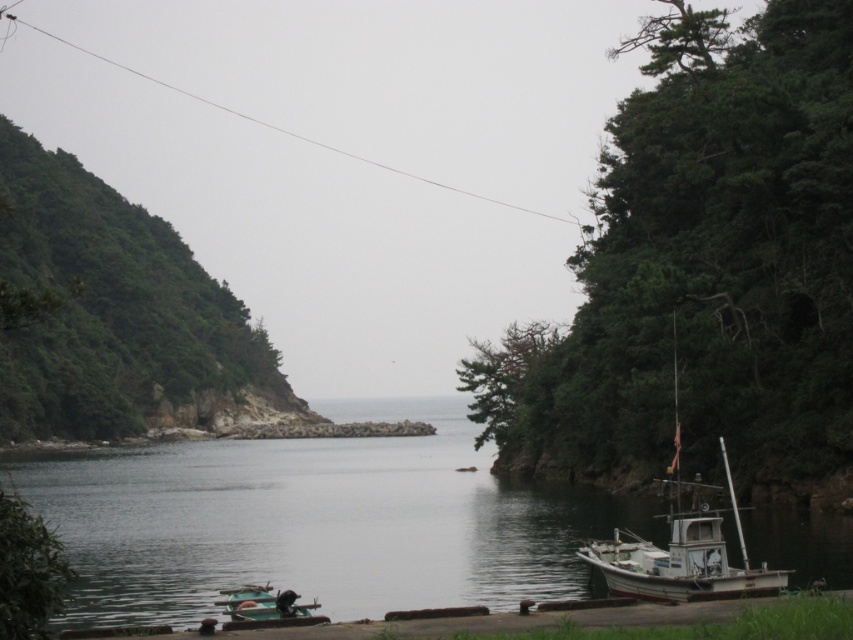
You are standing at the center of the image and want to walk towards the two points marked in the scene. Which point, point (74,211) or point (293,611), will you reach first?

Point (74,211) is further to the viewer than point (293,611), so you will reach point (74,211) first.

You are a photographer planning to capture the white matte boat at right and the green matte boat at lower left in a single frame. Based on their positions, which boat should you focus on first to ensure both are in the frame without moving the camera?

The white matte boat at right is positioned on the right side of the green matte boat at lower left, so you should focus on the green matte boat at lower left first to ensure both are within the frame without moving the camera.

You are a photographer planning to capture a landscape photo that emphasizes the green leafy hillside at left and the green matte boat at lower left. Based on their sizes in the image, which object should you focus on to ensure it dominates the composition?

The green leafy hillside at left is larger in size than the green matte boat at lower left, so focusing on it will ensure it dominates the composition.